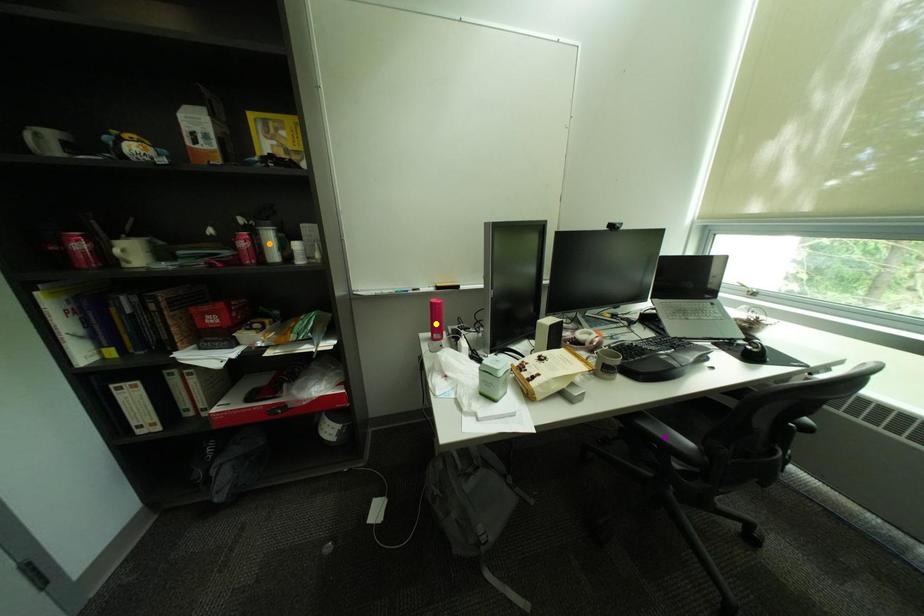
Order these from farthest to nearest:
purple point, orange point, yellow point

yellow point < orange point < purple point